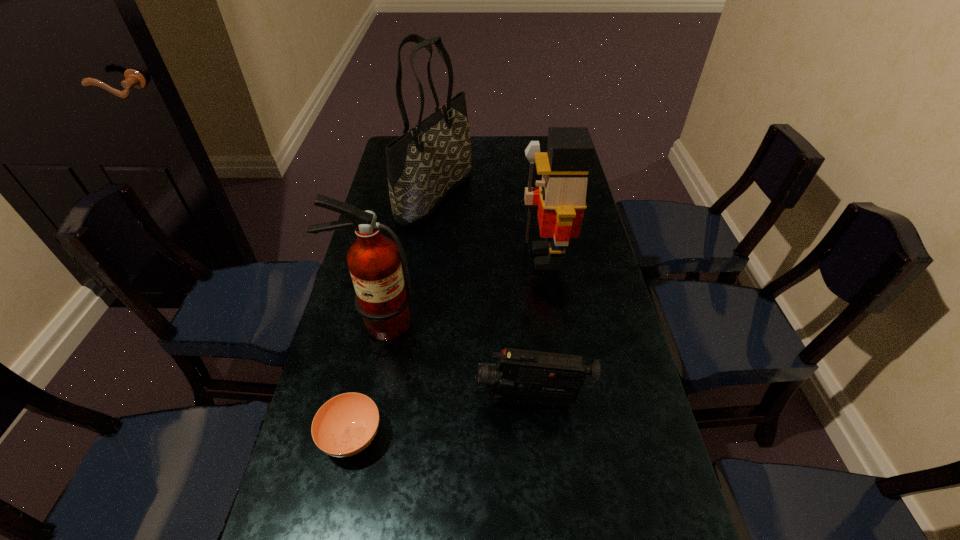
Where is `camcorder at the right edge`? camcorder at the right edge is located at coordinates (523, 377).

Locate an element on the screen. The image size is (960, 540). object located at the far left corner is located at coordinates (425, 164).

Locate an element on the screen. This screenshot has width=960, height=540. free point at the left edge is located at coordinates (346, 464).

In the image, there is a desktop. Identify the location of vacant space at the right edge. (667, 524).

Locate an element on the screen. free space between the third farthest object and the fourth nearest object is located at coordinates 462,290.

The image size is (960, 540). Identify the location of free space between the nutcracker and the camcorder. (539, 329).

Locate an element on the screen. This screenshot has width=960, height=540. free spot between the soup bowl and the second shortest object is located at coordinates (442, 418).

The width and height of the screenshot is (960, 540). What are the coordinates of `unoccupied area between the farthest object and the nutcracker` in the screenshot? It's located at (491, 226).

Where is `vacant space that is in between the tallest object and the fire extinguisher`? vacant space that is in between the tallest object and the fire extinguisher is located at coordinates (406, 259).

Where is `empty space that is in between the farthest object and the second shortest object`? This screenshot has width=960, height=540. empty space that is in between the farthest object and the second shortest object is located at coordinates (484, 298).